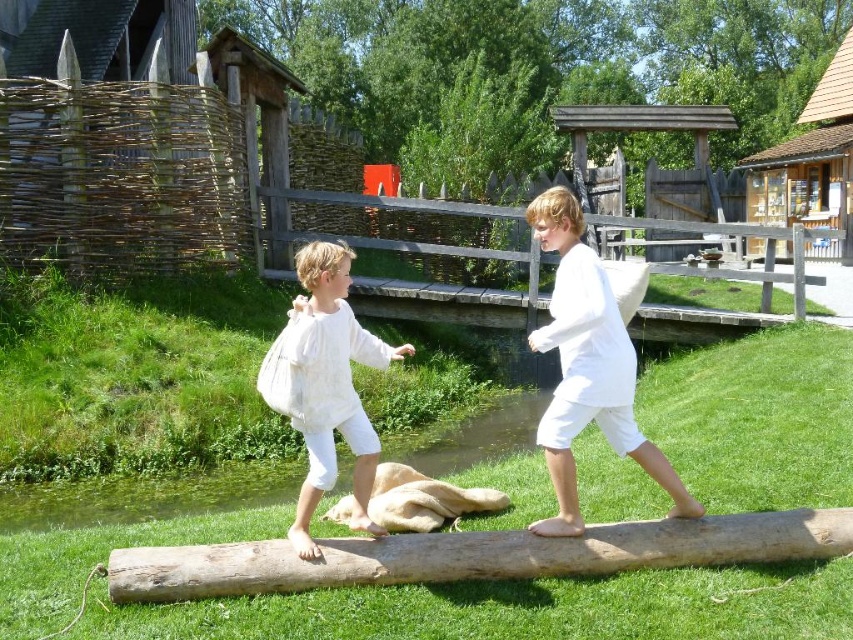
Question: Which of the following is the farthest from the observer?

Choices:
 (A) (410, 568)
 (B) (314, 353)

Answer: (A)

Question: Which object is positioned farthest from the brown rough log at center?

Choices:
 (A) green grassy bank at lower center
 (B) white fluffy dress at center
 (C) white cotton shirt at center

Answer: (A)

Question: Is white cotton shirt at center wider than green grassy bank at lower center?

Choices:
 (A) no
 (B) yes

Answer: (A)

Question: Based on their relative distances, which object is nearer to the brown rough log at center?

Choices:
 (A) green grassy bank at lower center
 (B) white fluffy dress at center

Answer: (B)

Question: Can you confirm if white cotton shirt at center is thinner than green grassy bank at lower center?

Choices:
 (A) yes
 (B) no

Answer: (A)

Question: Does green grassy bank at lower center have a larger size compared to white fluffy dress at center?

Choices:
 (A) yes
 (B) no

Answer: (B)